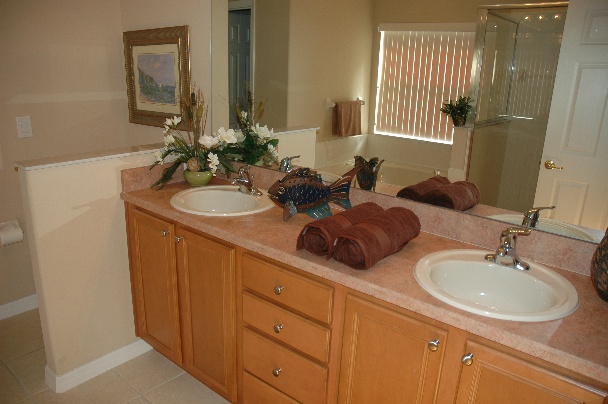
Locate an element on the screen. sink basin is located at coordinates (489, 297), (221, 197).